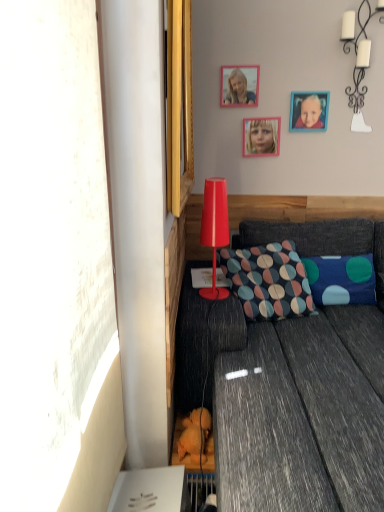
Question: Does white ceramic candlestick at upper right, arranged as the second lamp when viewed from the left, have a larger size compared to matte pink frame at upper center?

Choices:
 (A) yes
 (B) no

Answer: (A)

Question: Can you confirm if white ceramic candlestick at upper right, which is the 1th lamp from top to bottom, is taller than matte pink frame at upper center?

Choices:
 (A) yes
 (B) no

Answer: (A)

Question: Does white ceramic candlestick at upper right, the 2th lamp from the bottom, have a smaller size compared to matte pink frame at upper center?

Choices:
 (A) yes
 (B) no

Answer: (B)

Question: Does white ceramic candlestick at upper right, the 2th lamp from the bottom, appear on the right side of matte pink frame at upper center?

Choices:
 (A) yes
 (B) no

Answer: (A)

Question: Considering the relative positions of white ceramic candlestick at upper right, which is the first lamp from back to front, and matte pink frame at upper center in the image provided, is white ceramic candlestick at upper right, which is the first lamp from back to front, behind matte pink frame at upper center?

Choices:
 (A) no
 (B) yes

Answer: (A)

Question: Is white ceramic candlestick at upper right, which is the first lamp in right-to-left order, outside matte pink frame at upper center?

Choices:
 (A) yes
 (B) no

Answer: (A)

Question: Is multicolored fabric pillow at center, which is counted as the 1th pillow, starting from the left, closer to camera compared to matte plastic lamp at center, which ranks as the first lamp in bottom-to-top order?

Choices:
 (A) no
 (B) yes

Answer: (A)

Question: From the image's perspective, is multicolored fabric pillow at center, the second pillow from the right, under matte plastic lamp at center, marked as the first lamp in a left-to-right arrangement?

Choices:
 (A) yes
 (B) no

Answer: (A)

Question: Can you confirm if multicolored fabric pillow at center, which is counted as the 1th pillow, starting from the left, is positioned to the right of matte plastic lamp at center, positioned as the 2th lamp in back-to-front order?

Choices:
 (A) no
 (B) yes

Answer: (B)

Question: Can you confirm if multicolored fabric pillow at center, the second pillow from the right, is thinner than matte plastic lamp at center, which appears as the second lamp when viewed from the right?

Choices:
 (A) yes
 (B) no

Answer: (B)

Question: Does multicolored fabric pillow at center, the second pillow from the right, have a larger size compared to matte plastic lamp at center, marked as the first lamp in a left-to-right arrangement?

Choices:
 (A) yes
 (B) no

Answer: (A)

Question: Can you confirm if multicolored fabric pillow at center, which is counted as the 1th pillow, starting from the left, is wider than matte plastic lamp at center, the 1th lamp positioned from the front?

Choices:
 (A) no
 (B) yes

Answer: (B)

Question: Can you confirm if matte pink frame at upper center is positioned to the left of wooden picture frame at upper right, which is the first picture frame from right to left?

Choices:
 (A) no
 (B) yes

Answer: (B)